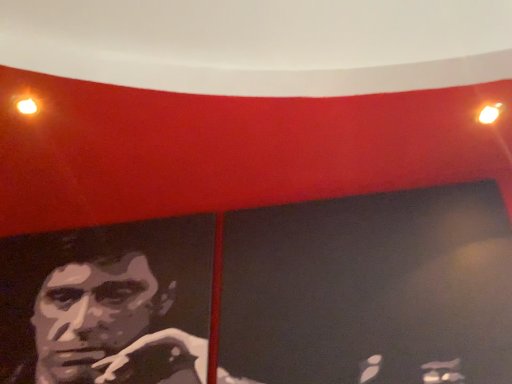
Image resolution: width=512 pixels, height=384 pixels. Describe the element at coordinates (108, 304) in the screenshot. I see `matte black portrait at left` at that location.

I want to click on matte black portrait at left, so [x=108, y=304].

Image resolution: width=512 pixels, height=384 pixels. What are the coordinates of `matte black portrait at left` in the screenshot? It's located at (108, 304).